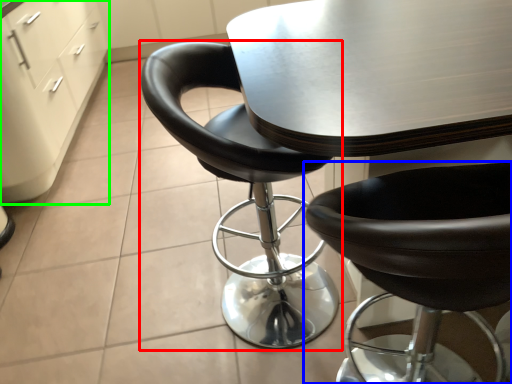
Question: Which object is positioned farthest from chair (highlighted by a red box)? Select from chair (highlighted by a blue box) and file cabinet (highlighted by a green box).

Choices:
 (A) chair
 (B) file cabinet

Answer: (B)